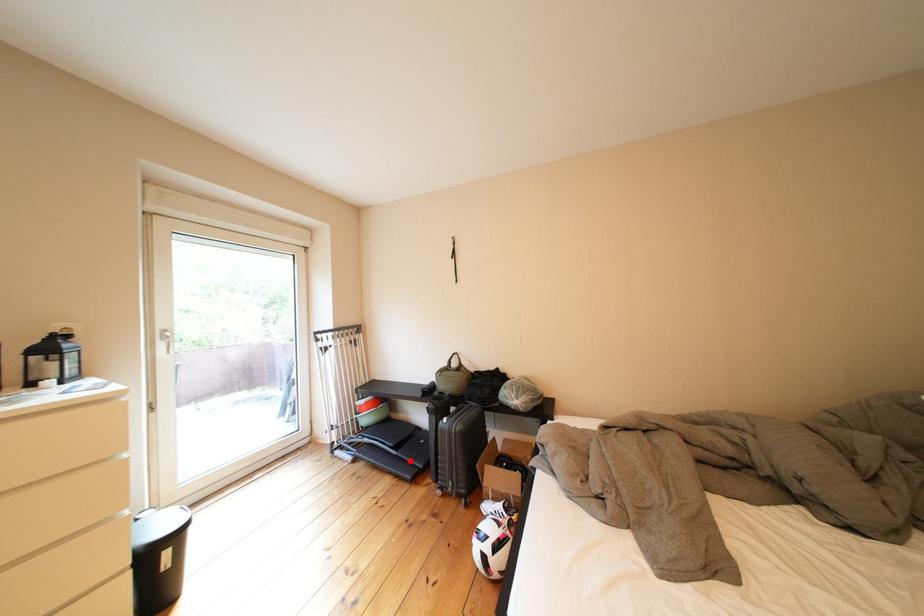
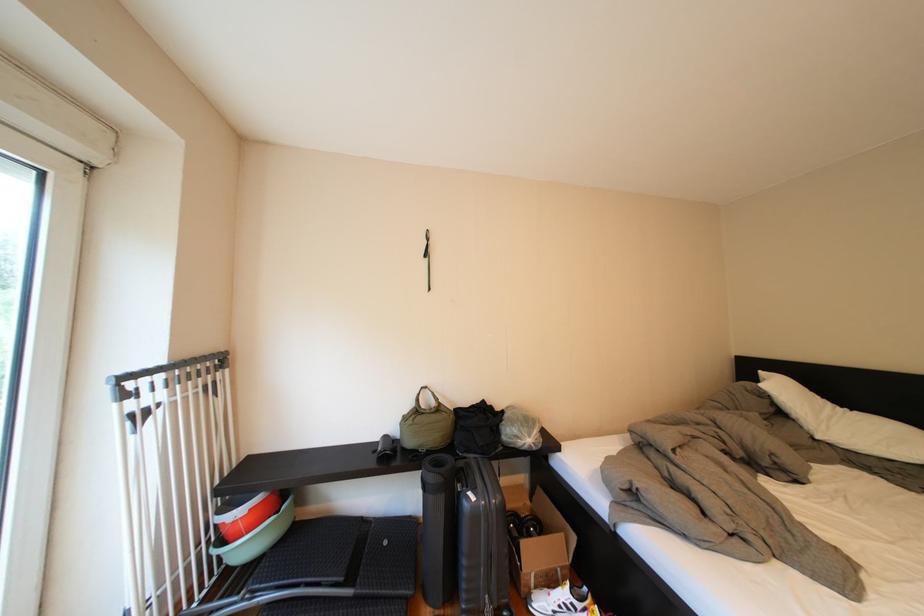
Locate, in the second image, the point that corresponds to the highlighted location in the first image.

(370, 602)